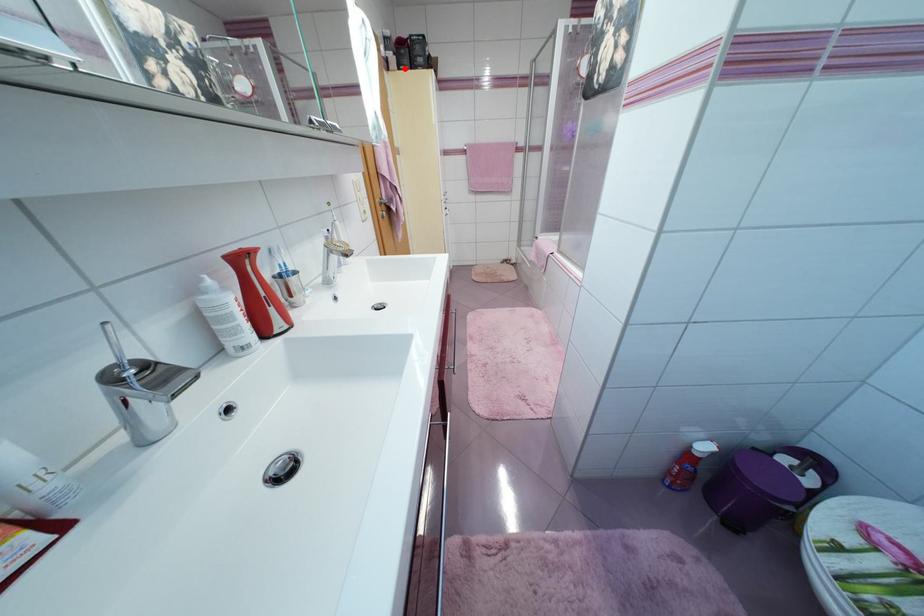
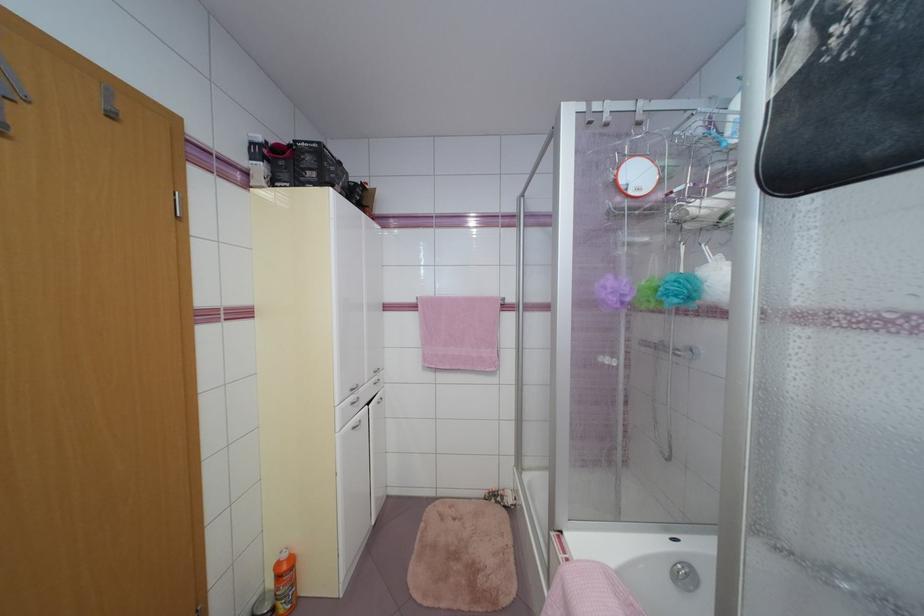
Find the pixel in the second image that matches the highlighted location in the first image.

(276, 185)